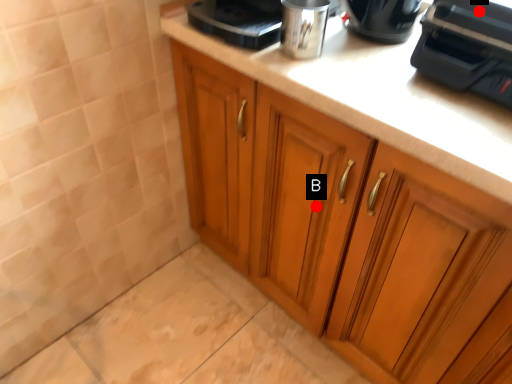
Question: Two points are circled on the image, labeled by A and B beside each circle. Which point is closer to the camera taking this photo?

Choices:
 (A) A is closer
 (B) B is closer

Answer: (A)